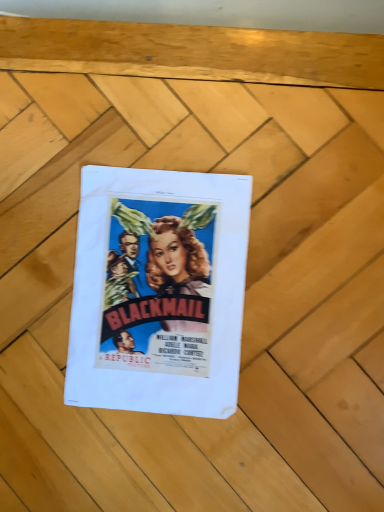
Locate an element on the screen. vacant space situated above matte paper poster at center (from a real-world perspective) is located at coordinates (147, 294).